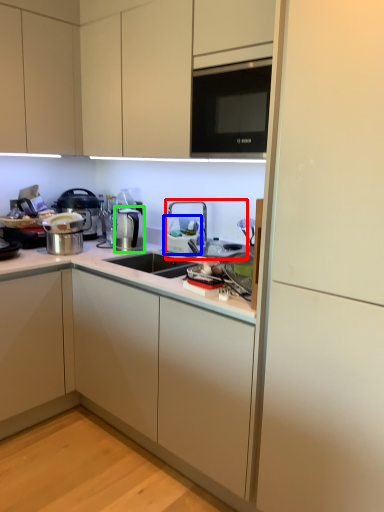
Question: Which object is positioned closest to sink (highlighted by a red box)? Select from appliance (highlighted by a blue box) and coffee machine (highlighted by a green box).

Choices:
 (A) appliance
 (B) coffee machine

Answer: (A)